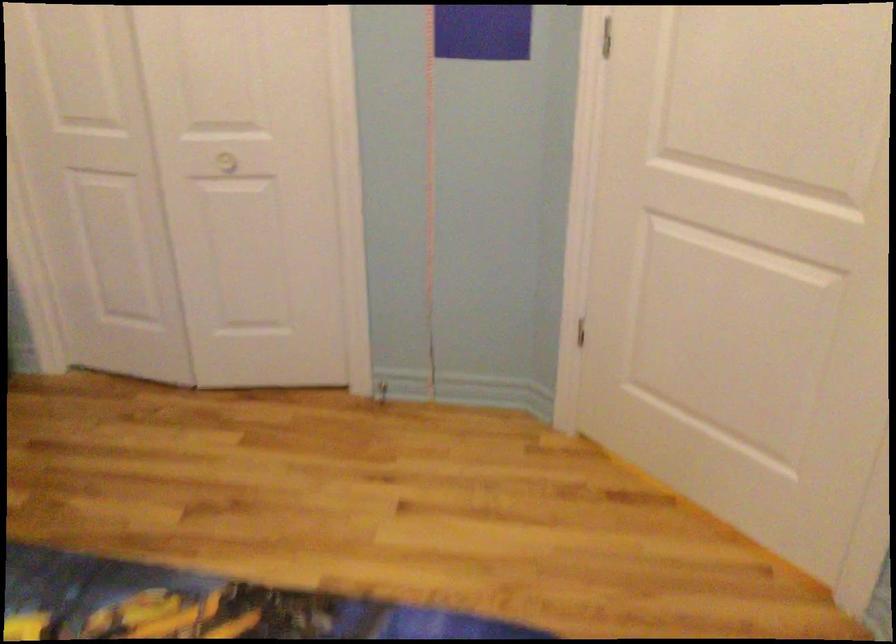
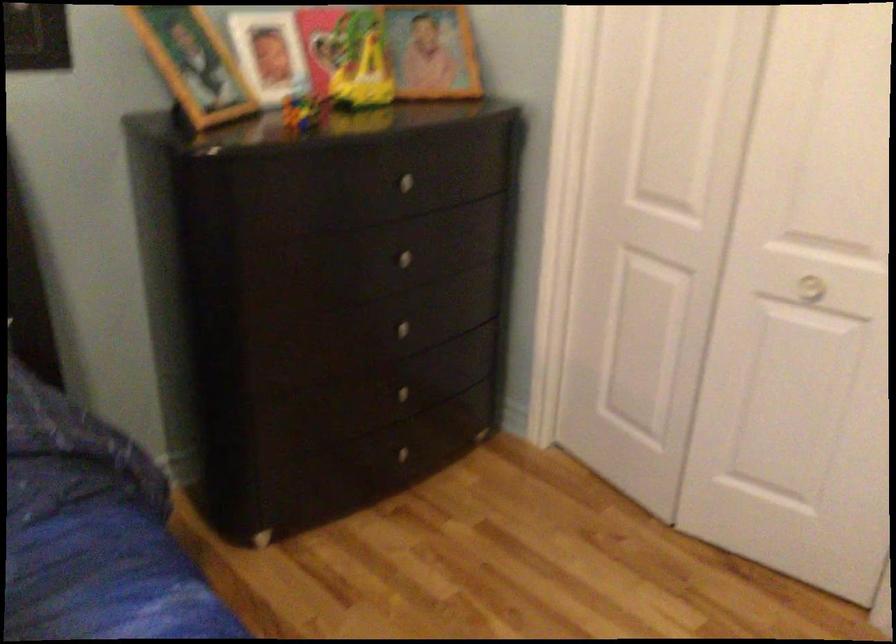
Where in the second image is the point corresponding to (222,158) from the first image?

(810, 288)